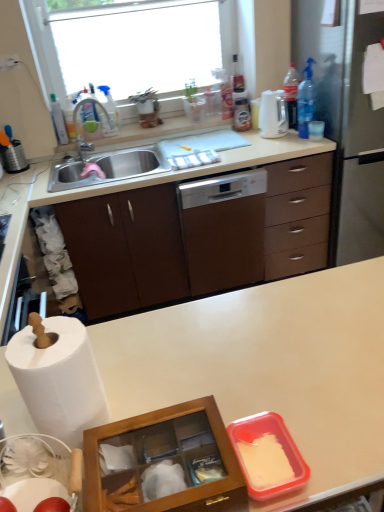
Locate an element on the screen. free location in front of white glossy electric kettle at upper right is located at coordinates (290, 144).